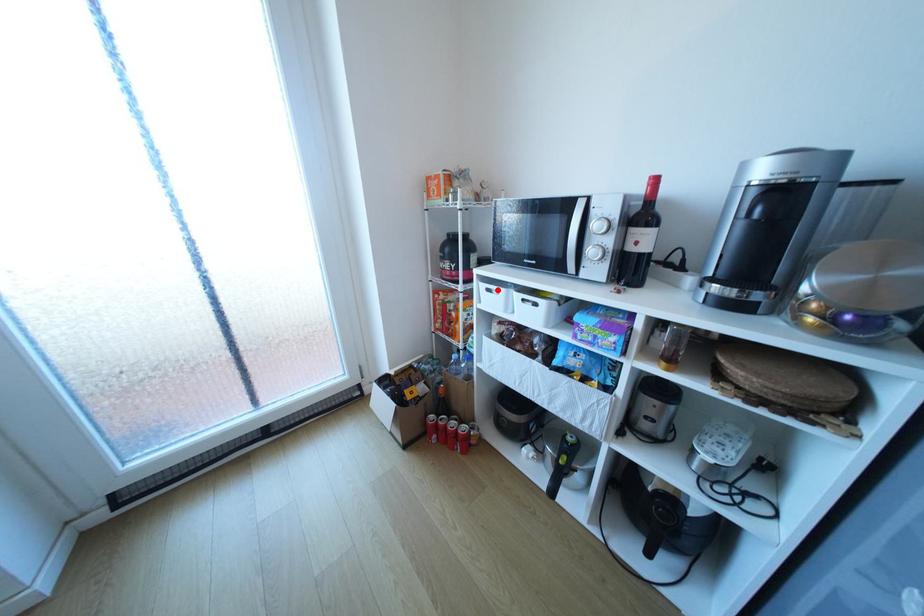
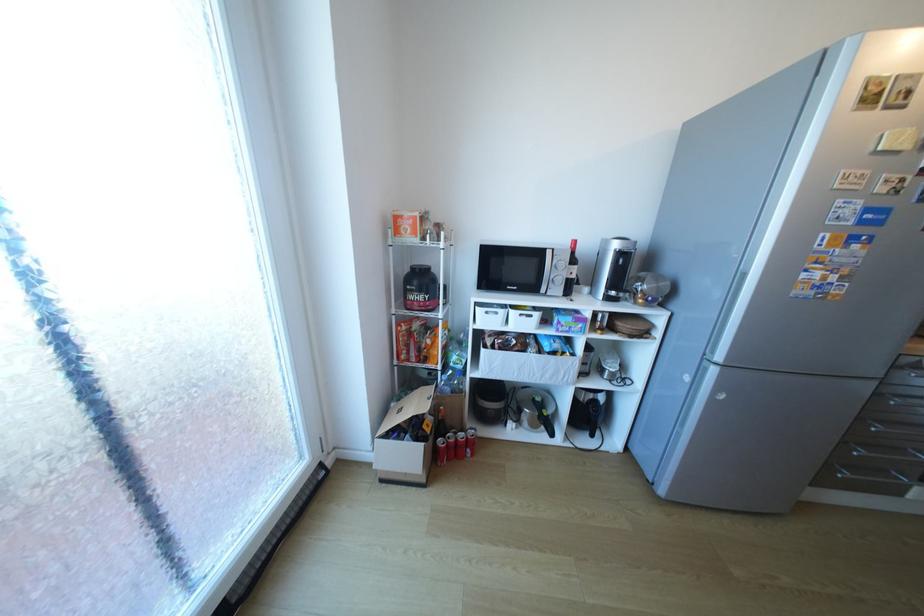
Question: I am providing you with two images of the same scene from different viewpoints. A red point is marked on the first image. Is the red point's position out of view in image 2?

Choices:
 (A) Yes
 (B) No

Answer: (B)